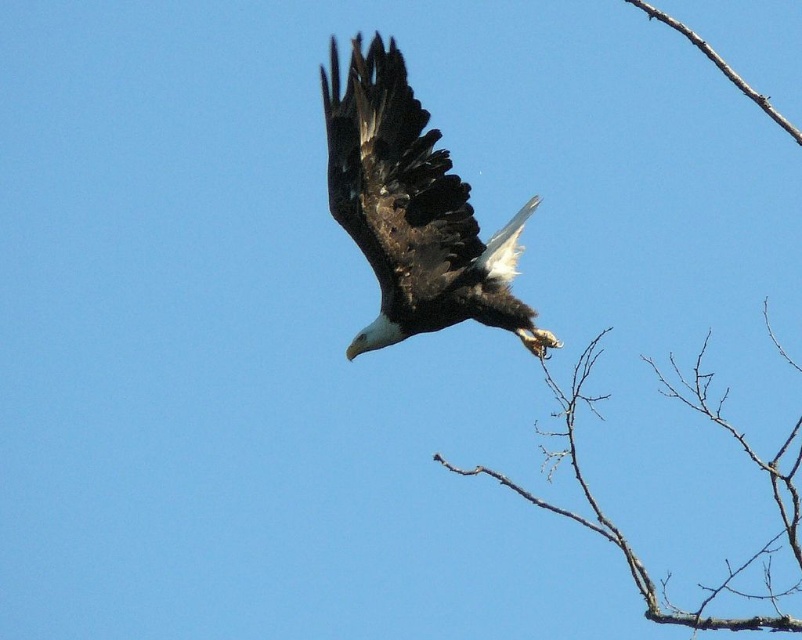
You are a photographer trying to capture the bald eagle in flight. You notice two points in the scene labeled as point 1 at coordinates point (x=511, y=296) and point 2 at coordinates point (x=592, y=401). Which point is closer to your camera lens?

Point 1 at coordinates point (x=511, y=296) is closer to the camera lens because it is further to the camera than point 2 at coordinates point (x=592, y=401).

You are an ornithologist observing a bald eagle in flight. You notice the dark brown feathers at center and the brown twig at upper right. Which object has a greater width?

The brown twig at upper right has a greater width than the dark brown feathers at center.

You are a birdwatcher trying to identify the bald eagle in the sky. You notice a brown twig at upper right and dark brown feathers at center. Which object is closer to you?

The dark brown feathers at center are closer to you because the brown twig at upper right is behind them.